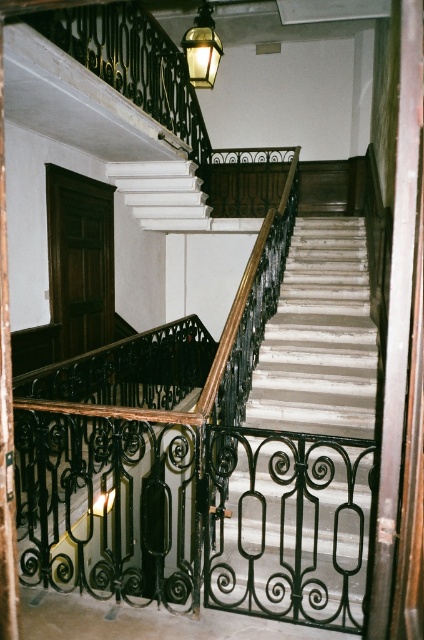
Consider the image. You are standing at the base of the grand staircase and want to reach the door at the top left corner. Which direction should you head relative to the white marble stairs at center?

To reach the door at the top left corner, you should head towards the left relative to the white marble stairs at center since the door is located at the top left corner of the scene.

You are a delivery person carrying a large package that is 1 meter wide. You need to navigate through the white marble stairs at center and the matte brass lantern at upper center. Can you pass through the space between them without tilting the package?

The white marble stairs at center might be wider than matte brass lantern at upper center, but the description does not provide exact measurements. Without knowing the exact width of the space between them, it is uncertain if the 1 meter wide package can pass safely. You should measure the space first before attempting to move the package through.

You are standing at the bottom of the staircase and want to hang a new decorative item. The matte brass lantern at upper center is currently above the white marble stairs at center. Where should you place the new item if you want it to be positioned between these two objects?

You should place the new item between the white marble stairs at center and the matte brass lantern at upper center since the lantern is above the stairs.